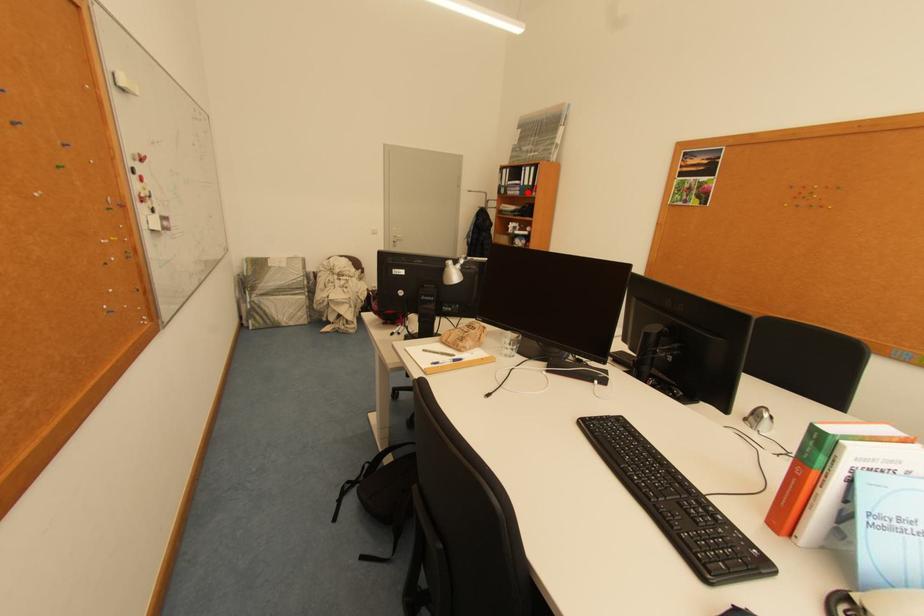
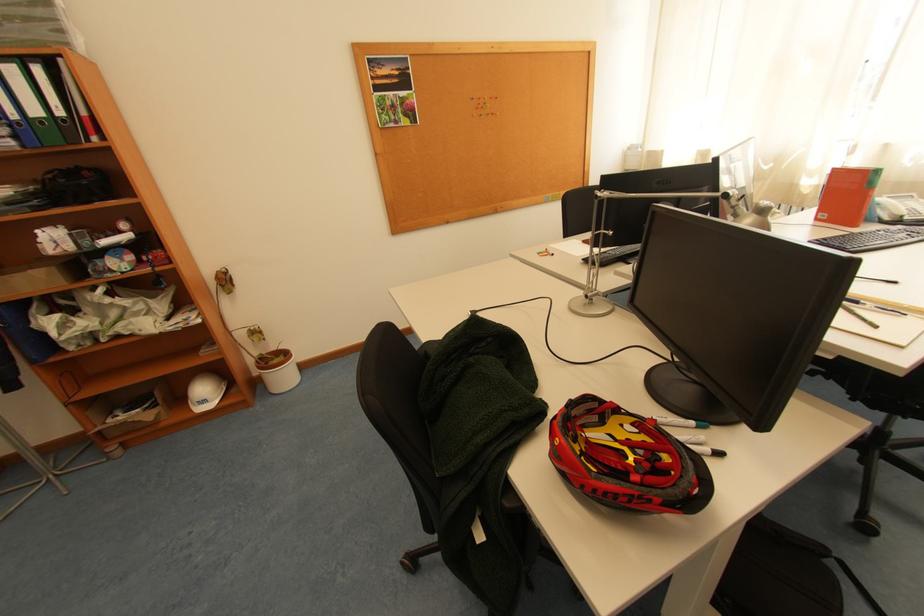
The point at the highlighted location is marked in the first image. Where is the corresponding point in the second image?

(23, 139)